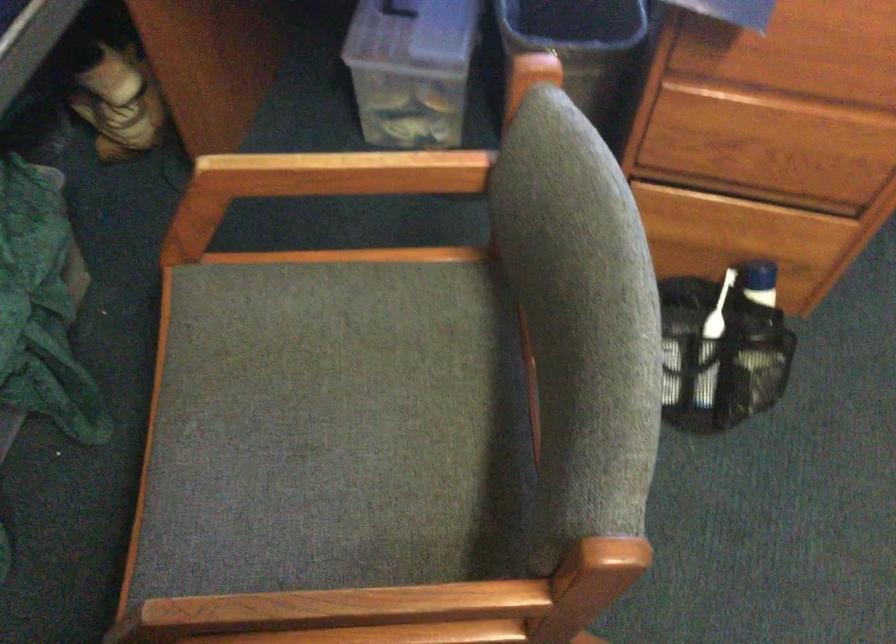
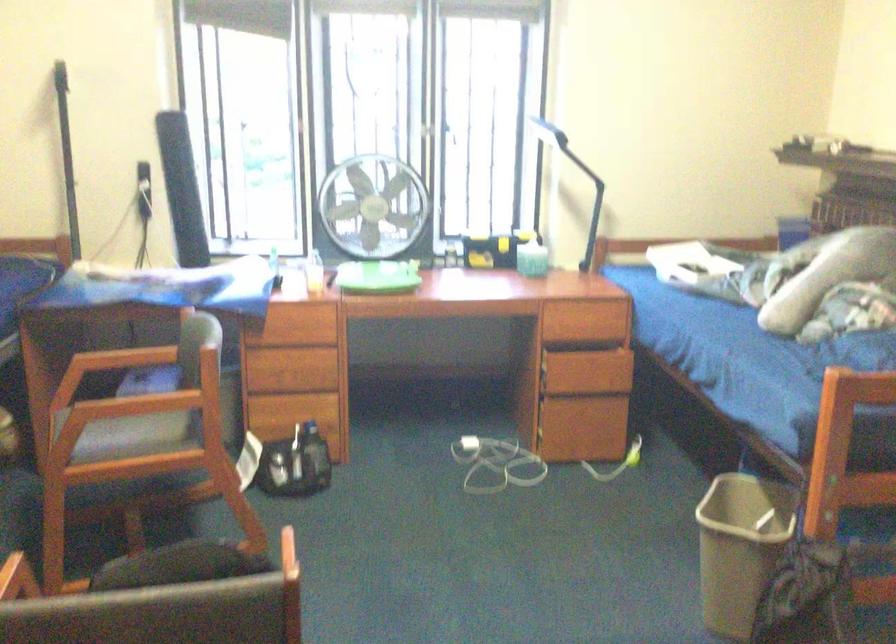
The point at (409, 404) is marked in the first image. Where is the corresponding point in the second image?

(156, 427)